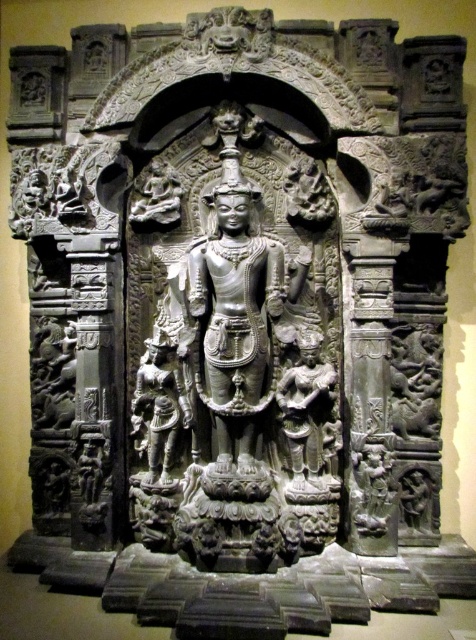
In the image of the stone relief sculpture, there are two figures made of gray stone. The dark gray stone statue at center and the gray stone figure at lower left. Which one is bigger?

The dark gray stone statue at center is larger in size than the gray stone figure at lower left.

You are an art conservator examining the sculpture. You need to move the gray stone figure at lower left to a different display area. Which direction should you move it so that the dark gray stone statue at center remains in its original position?

The dark gray stone statue at center is positioned on the right side of the gray stone figure at lower left. To keep the dark gray stone statue at center in its original position, you should move the gray stone figure at lower left to the left side of the dark gray stone statue at center.

Looking at this image, you are an art conservator examining the stone relief sculpture. You notice two points of concern marked on the sculpture. The first point is at coordinate point [326,449] and the second at point [140,365]. Which of these points is closer to the viewer?

Point [326,449] is in front of point [140,365], so it is closer to the viewer.